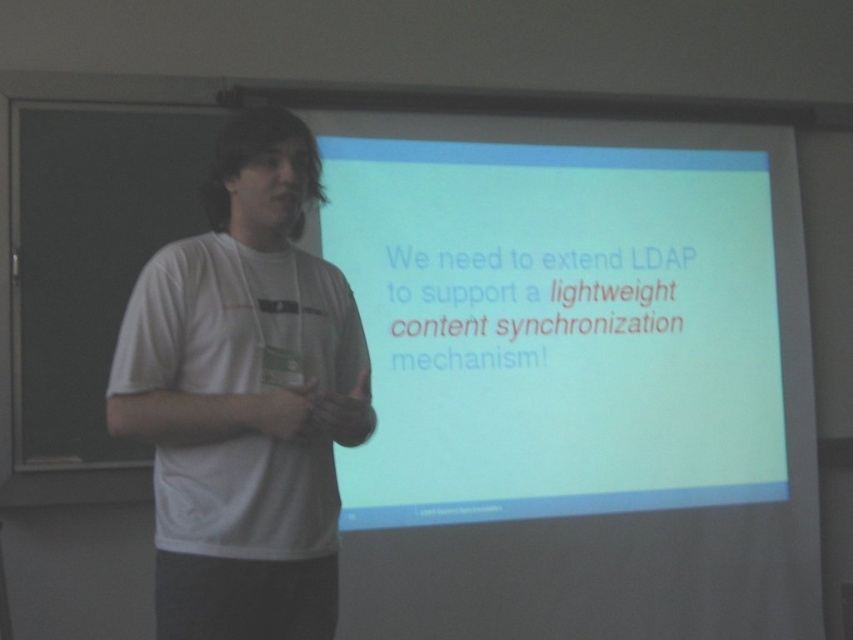
You are an attendee at a tech conference and see the presenter wearing a white cotton shirt at center and standing in front of a white matte projection screen at center. Which object is taller?

The white matte projection screen at center is much taller than the white cotton shirt at center.

You are an attendee at a tech conference and notice the white matte projection screen at center and the white cotton shirt at center. From your perspective, which object is located to the right of the other?

The white matte projection screen at center is positioned on the right side of the white cotton shirt at center, so from your perspective, the projection screen is to the right of the shirt.